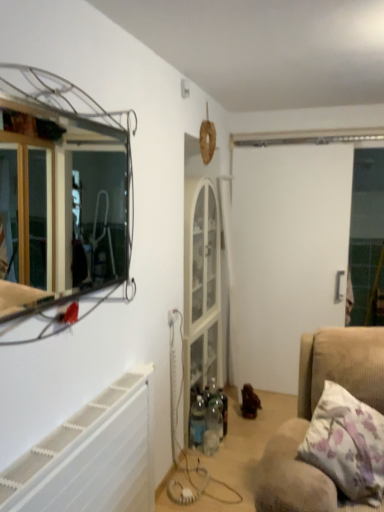
Question: From a real-world perspective, is white matte screen door at center located beneath brown wooden toy at center?

Choices:
 (A) yes
 (B) no

Answer: (B)

Question: Is white matte screen door at center thinner than brown wooden toy at center?

Choices:
 (A) yes
 (B) no

Answer: (A)

Question: Is white matte screen door at center positioned before brown wooden toy at center?

Choices:
 (A) no
 (B) yes

Answer: (A)

Question: From the image's perspective, is white matte screen door at center under brown wooden toy at center?

Choices:
 (A) no
 (B) yes

Answer: (A)

Question: Is white matte screen door at center bigger than brown wooden toy at center?

Choices:
 (A) no
 (B) yes

Answer: (B)

Question: Looking at the image, does brown wooden toy at center seem bigger or smaller compared to metallic wire frame mirror at upper left?

Choices:
 (A) small
 (B) big

Answer: (A)

Question: Do you think brown wooden toy at center is within metallic wire frame mirror at upper left, or outside of it?

Choices:
 (A) inside
 (B) outside

Answer: (B)

Question: Is point (261, 407) closer or farther from the camera than point (112, 240)?

Choices:
 (A) farther
 (B) closer

Answer: (B)

Question: Is brown wooden toy at center to the left or to the right of metallic wire frame mirror at upper left in the image?

Choices:
 (A) left
 (B) right

Answer: (B)

Question: Is metallic wire frame mirror at upper left spatially inside white plastic radiator at lower left, or outside of it?

Choices:
 (A) inside
 (B) outside

Answer: (B)

Question: Is point (84, 232) positioned closer to the camera than point (122, 425)?

Choices:
 (A) farther
 (B) closer

Answer: (A)

Question: From a real-world perspective, is metallic wire frame mirror at upper left physically located above or below white plastic radiator at lower left?

Choices:
 (A) below
 (B) above

Answer: (B)

Question: From their relative heights in the image, would you say metallic wire frame mirror at upper left is taller or shorter than white plastic radiator at lower left?

Choices:
 (A) tall
 (B) short

Answer: (A)

Question: From the image's perspective, is metallic wire frame mirror at upper left located above or below white matte screen door at center?

Choices:
 (A) above
 (B) below

Answer: (A)

Question: Considering the positions of metallic wire frame mirror at upper left and white matte screen door at center in the image, is metallic wire frame mirror at upper left bigger or smaller than white matte screen door at center?

Choices:
 (A) big
 (B) small

Answer: (B)